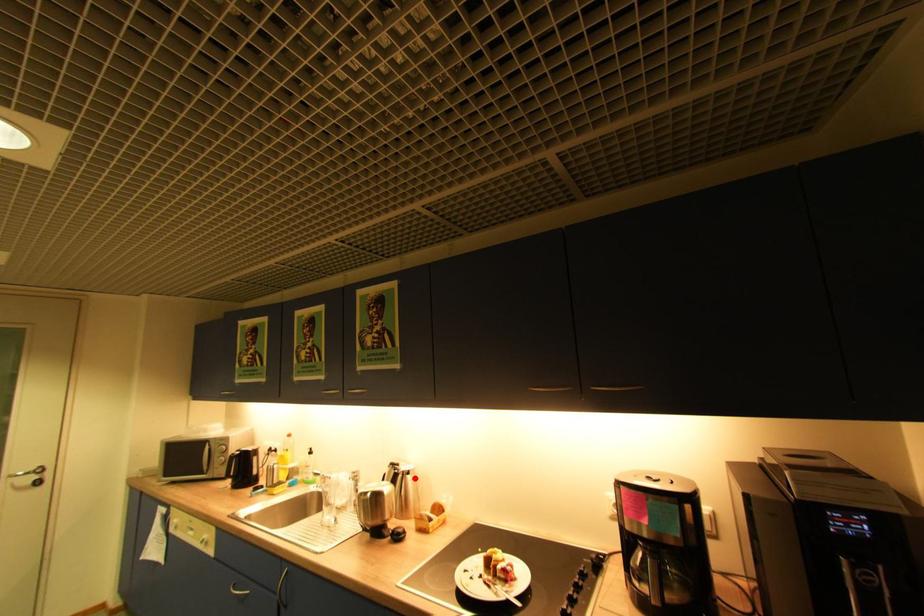
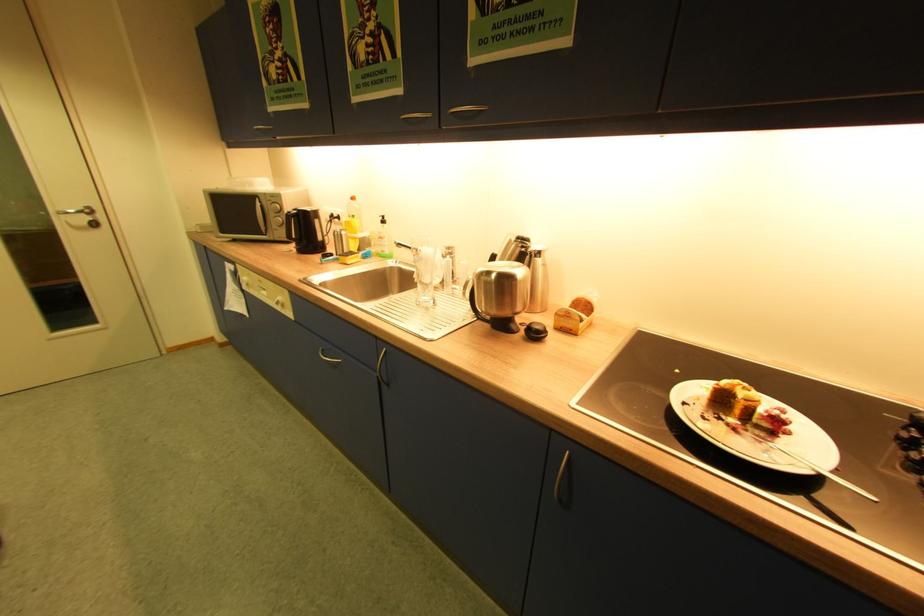
In the second image, find the point that corresponds to the highlighted location in the first image.

(543, 261)